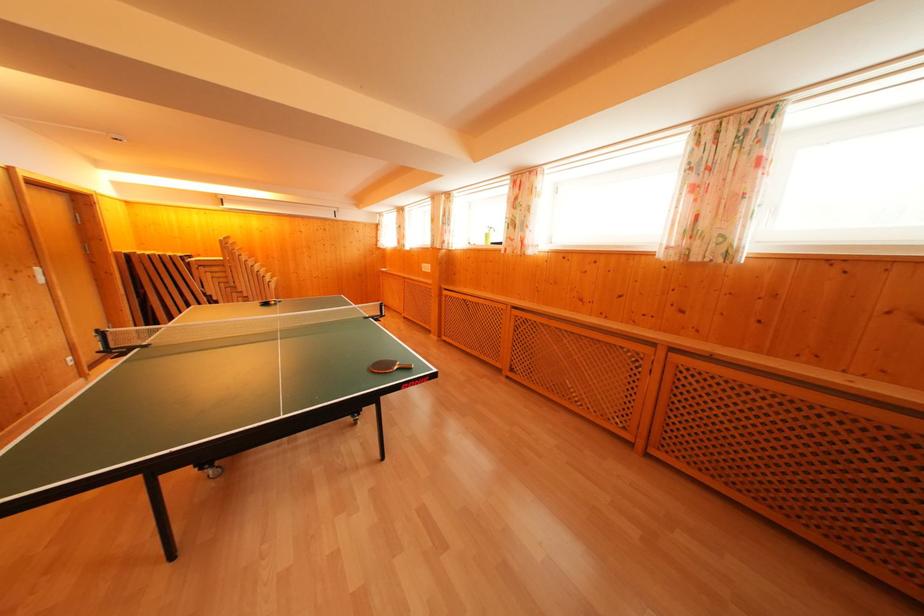
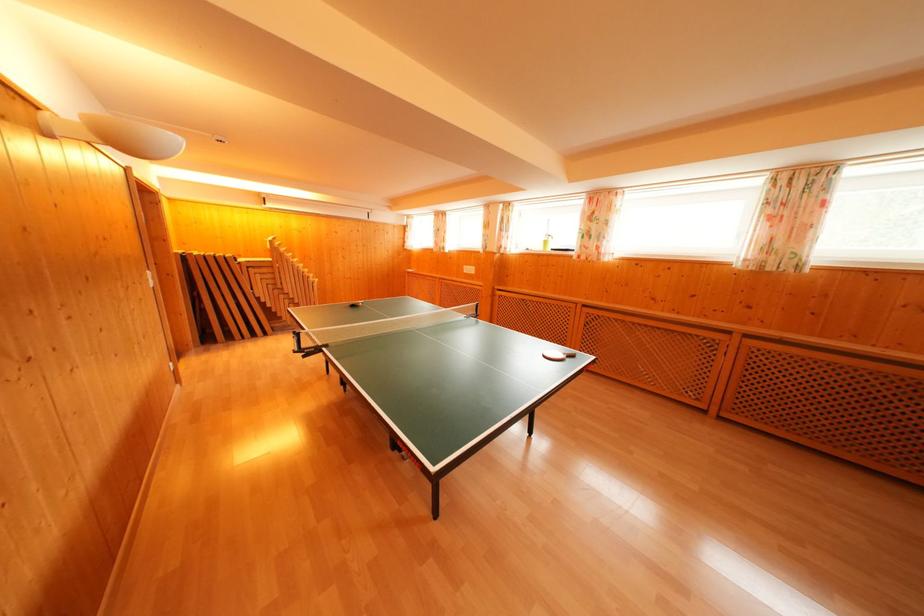
Question: Which direction would the cameraman need to move to produce the second image? Reply with the corresponding letter.

Choices:
 (A) Left
 (B) Right
 (C) Forward
 (D) Backward

Answer: (A)